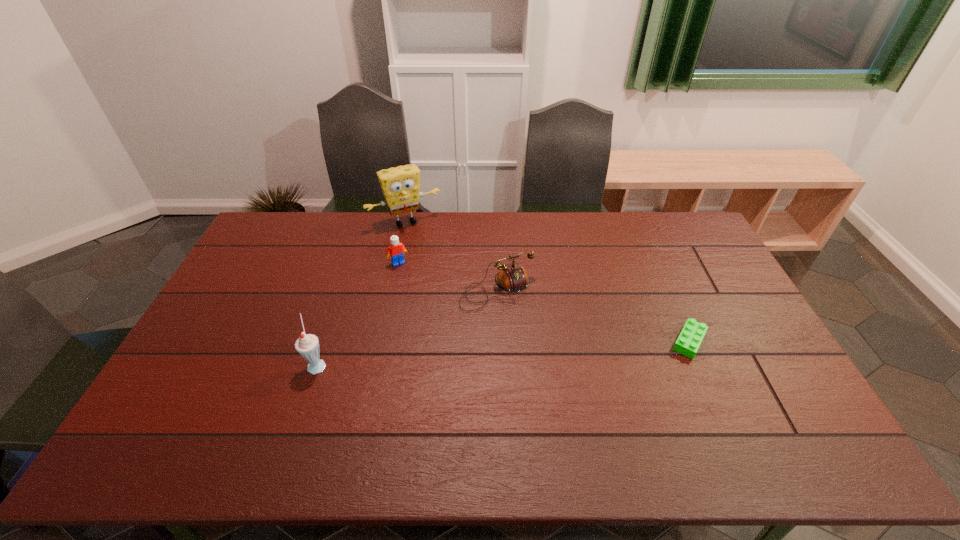
The height and width of the screenshot is (540, 960). Identify the location of free space located 0.060m on the left of the shortest object. (648, 341).

At what (x,y) coordinates should I click in order to perform the action: click on free space located on the face of the farthest object. Please return your answer as a coordinate pair (x, y). Looking at the image, I should click on (438, 267).

Where is `vacant region located on the face of the farthest object`? Image resolution: width=960 pixels, height=540 pixels. vacant region located on the face of the farthest object is located at coordinates (449, 287).

You are a GUI agent. You are given a task and a screenshot of the screen. Output one action in this format:
    pyautogui.click(x=<x>, y=<y>)
    Task: Click on the vacant space situated on the face of the farthest object
    The height and width of the screenshot is (540, 960).
    Given the screenshot: What is the action you would take?
    pyautogui.click(x=456, y=299)

This screenshot has width=960, height=540. Identify the location of vacant space positioned on the rotary dial of the third nearest object. (560, 381).

The width and height of the screenshot is (960, 540). Find the location of `vacant space situated on the rotary dial of the third nearest object`. vacant space situated on the rotary dial of the third nearest object is located at coordinates (534, 340).

Find the location of a particular element. free region located on the rotary dial of the third nearest object is located at coordinates [x=583, y=414].

Image resolution: width=960 pixels, height=540 pixels. Identify the location of free space located 0.220m on the face of the farther Lego. (426, 308).

This screenshot has height=540, width=960. I want to click on vacant space located on the face of the farther Lego, so click(446, 343).

At what (x,y) coordinates should I click in order to perform the action: click on vacant area situated on the face of the farther Lego. Please return your answer as a coordinate pair (x, y). Looking at the image, I should click on (424, 306).